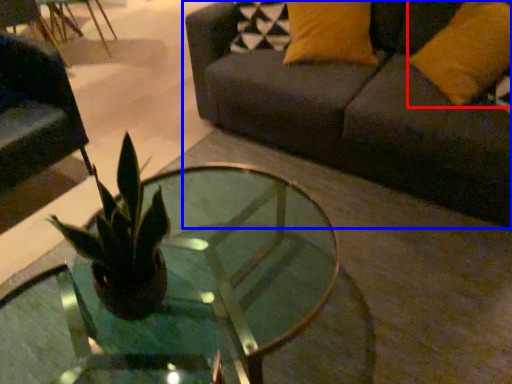
Question: Which object is further to the camera taking this photo, pillow (highlighted by a red box) or studio couch (highlighted by a blue box)?

Choices:
 (A) pillow
 (B) studio couch

Answer: (A)